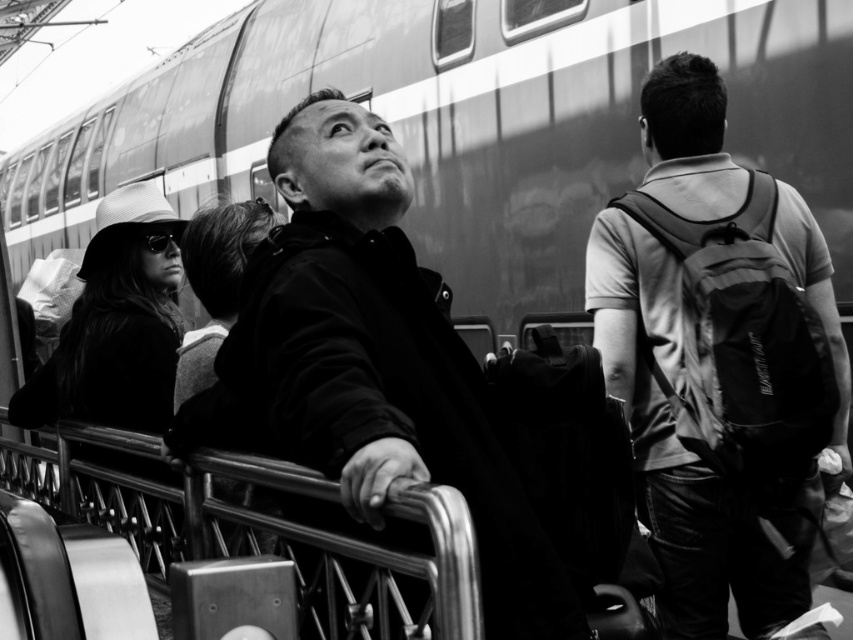
Question: Is matte black jacket at center further to camera compared to matte black backpack at center?

Choices:
 (A) yes
 (B) no

Answer: (B)

Question: Does matte black jacket at center appear under matte black backpack at center?

Choices:
 (A) yes
 (B) no

Answer: (A)

Question: Does matte black jacket at center appear on the right side of matte black backpack at center?

Choices:
 (A) no
 (B) yes

Answer: (A)

Question: Which point is closer to the camera?

Choices:
 (A) (218, 417)
 (B) (683, 499)

Answer: (A)